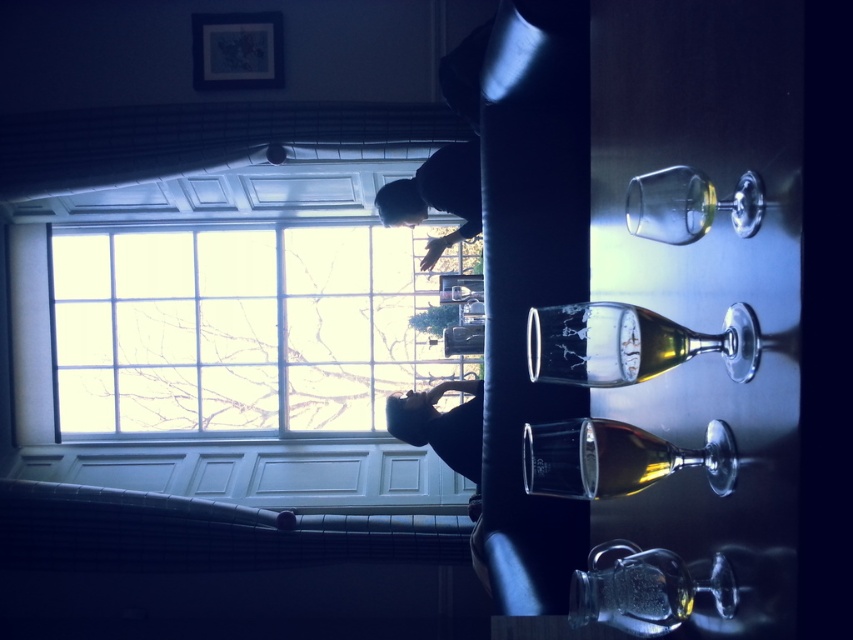
You are standing in the rotated bar or restaurant scene described. If you were to draw a straight line from the center of the large window to the translucent glass wine bottle at center, would the line pass through the greenery near the bottom right corner of the window?

The translucent glass wine bottle at center is located at point (630, 342). Since the window is in the background and the bottle is at the center of the image, the line drawn from the window center to the bottle would not pass through the greenery near the bottom right corner of the window.

You are a photographer trying to capture the view outside the clear glass window at upper left. You have a camera with a lens that can focus on objects up to 10 meters away. The translucent glass wine bottle at center is blocking your view. Can you still take the photo without moving the bottle?

The clear glass window at upper left is taller than the translucent glass wine bottle at center. Since the window is higher, you can adjust your camera angle upwards to capture the view outside without moving the bottle.